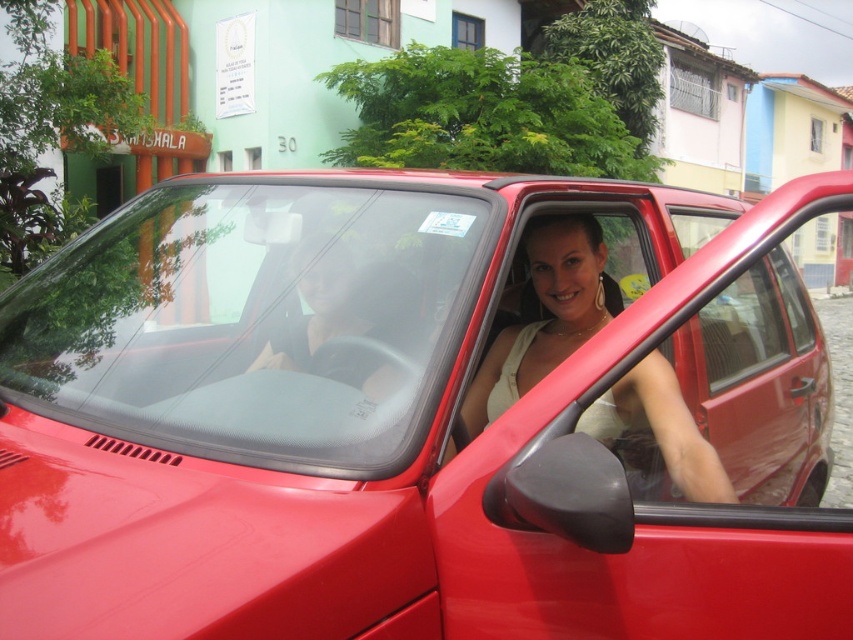
You are a photographer trying to capture the matte white dress at center without the glossy red car at center blocking it. Is this possible given their positions?

The glossy red car at center is closer to the viewer than the matte white dress at center, so the car would block the view of the dress. You would need to move your position to avoid the car obstructing the dress.

You are a pedestrian standing on the sidewalk and see the glossy red car at center and the matte black shirt at center. Which object is positioned lower in the image?

The glossy red car at center is located below the matte black shirt at center, so the glossy red car at center is positioned lower in the image.

You are standing in front of the red car parked in front of the colorful building. You notice two points marked in the scene. The first point is at coordinate point (751, 470) and the second point is at coordinate point (305, 296). Which point is closer to you?

Point (751, 470) is further to the viewer than point (305, 296), so the second point at (305, 296) is closer to you.